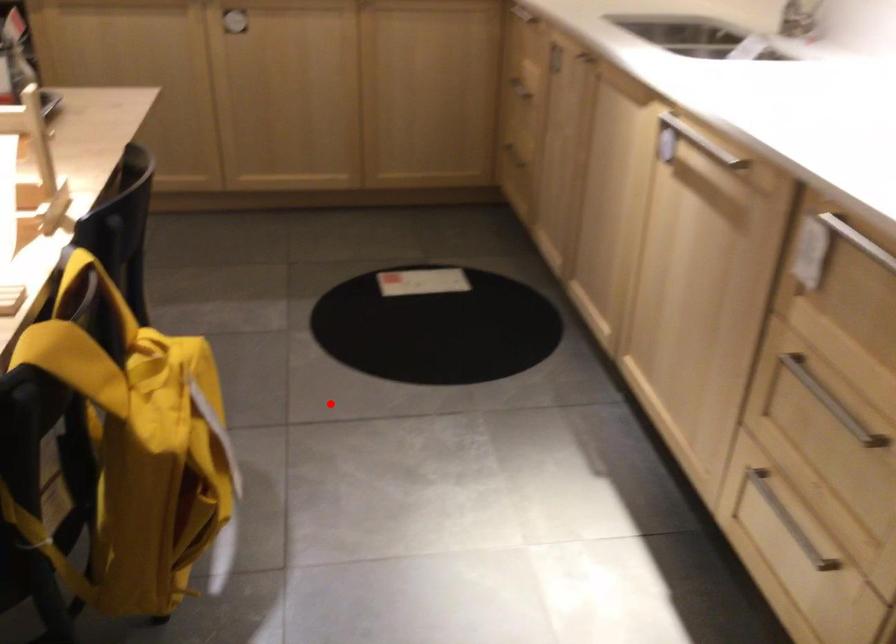
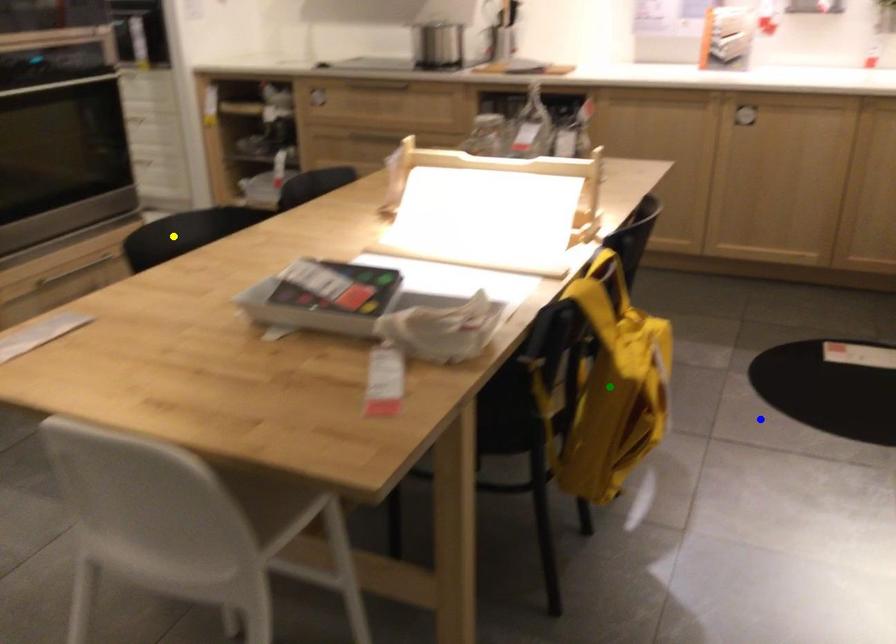
Question: I am providing you with two images of the same scene from different viewpoints. A red point is marked on the first image. You are given multiple points on the second image. Which point in image 2 is actually the same real-world point as the red point in image 1?

Choices:
 (A) yellow point
 (B) blue point
 (C) green point

Answer: (B)